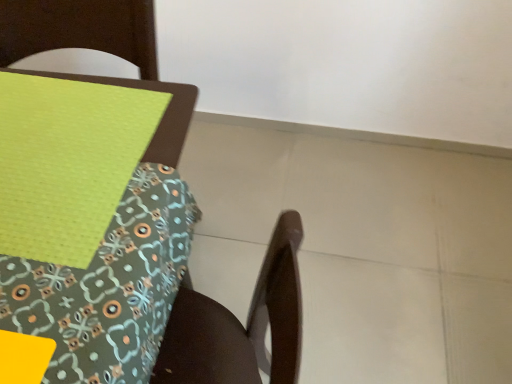
Where is `empty space that is ontop of green fabric placemat at upper left`? empty space that is ontop of green fabric placemat at upper left is located at coordinates (49, 144).